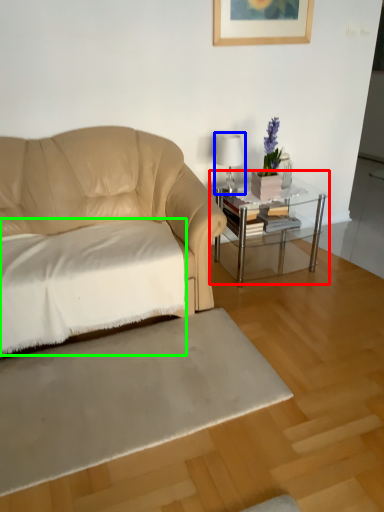
Question: Which object is the closest to the table (highlighted by a red box)? Choose among these: table lamp (highlighted by a blue box) or sheet (highlighted by a green box).

Choices:
 (A) table lamp
 (B) sheet

Answer: (A)